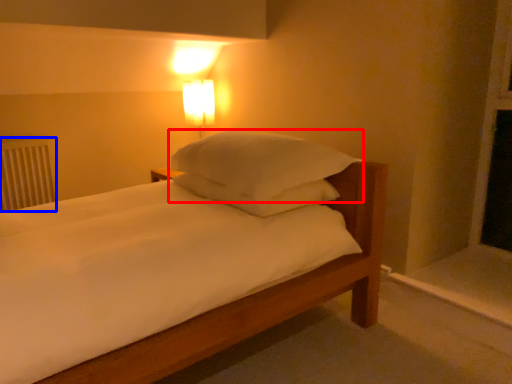
Question: Which object appears closest to the camera in this image, pillow (highlighted by a red box) or radiator (highlighted by a blue box)?

Choices:
 (A) pillow
 (B) radiator

Answer: (A)